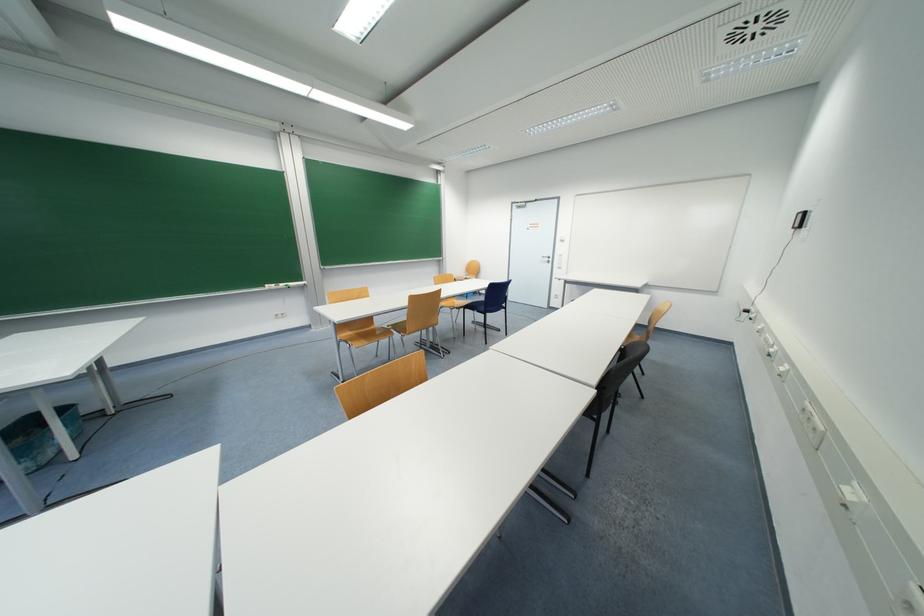
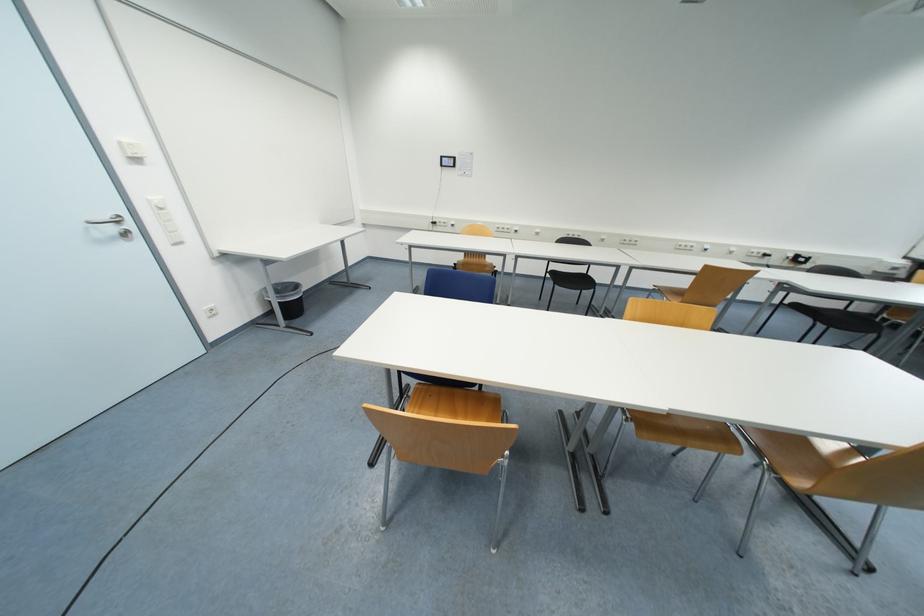
Locate, in the second image, the point that corresponds to (x=552, y=261) in the first image.

(117, 230)